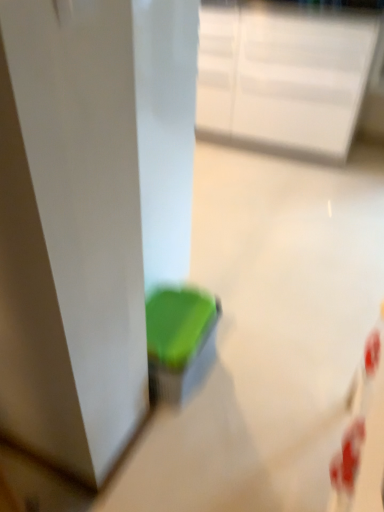
Identify the location of free location above green plastic container at center (from a real-world perspective). This screenshot has height=512, width=384. (173, 321).